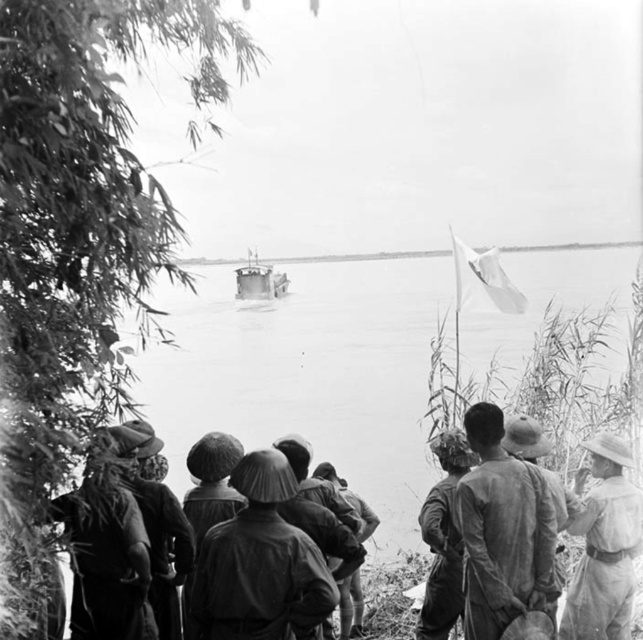
Looking at this image, can you confirm if matte brown helmet at center is thinner than camouflage fabric hat at center?

In fact, matte brown helmet at center might be wider than camouflage fabric hat at center.

Image resolution: width=643 pixels, height=640 pixels. Describe the element at coordinates (258, 563) in the screenshot. I see `matte brown helmet at center` at that location.

You are a GUI agent. You are given a task and a screenshot of the screen. Output one action in this format:
    pyautogui.click(x=<x>, y=<y>)
    Task: Click on the matte brown helmet at center
    The width and height of the screenshot is (643, 640).
    Given the screenshot: What is the action you would take?
    pyautogui.click(x=258, y=563)

Identify the location of matte brown helmet at center. (258, 563).

Can you confirm if light brown fabric hat at right is thinner than metallic gray boat at center?

Indeed, light brown fabric hat at right has a lesser width compared to metallic gray boat at center.

Who is more forward, (615, 500) or (278, 280)?

Point (615, 500) is more forward.

Where is `light brown fabric hat at right`? This screenshot has height=640, width=643. light brown fabric hat at right is located at coordinates (604, 545).

Can you confirm if rough fabric shirt at center is shorter than metallic gray boat at center?

Yes.

Can you confirm if rough fabric shirt at center is taller than metallic gray boat at center?

No.

Which is behind, point (502, 582) or point (260, 284)?

The point (260, 284) is more distant.

Locate an element on the screen. Image resolution: width=643 pixels, height=640 pixels. rough fabric shirt at center is located at coordinates (502, 531).